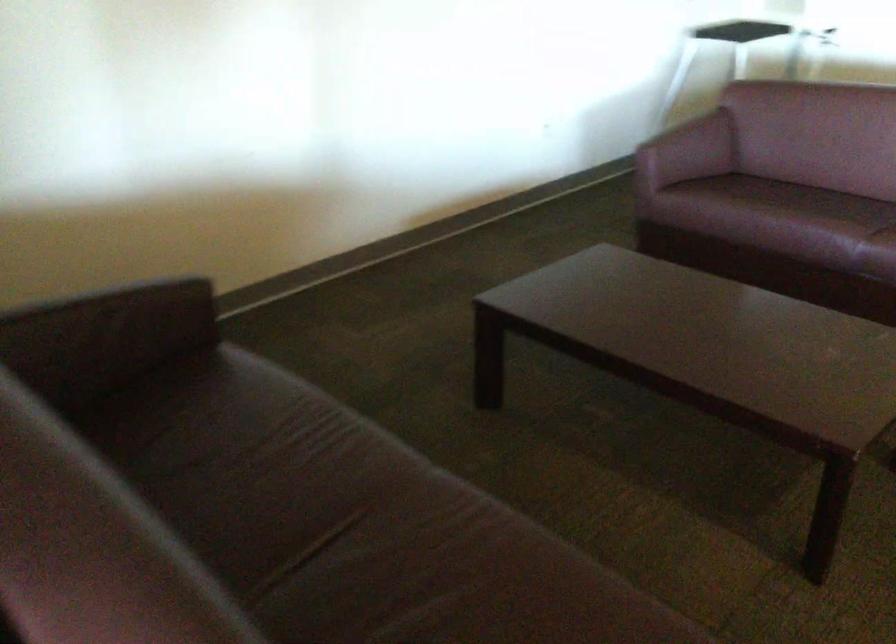
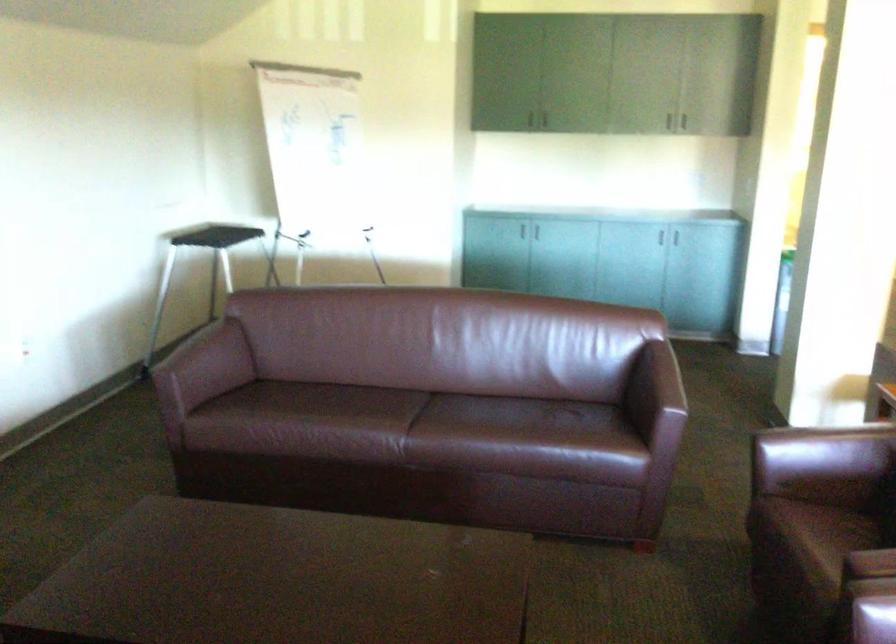
How did the camera likely rotate?

The camera rotated toward right-down.